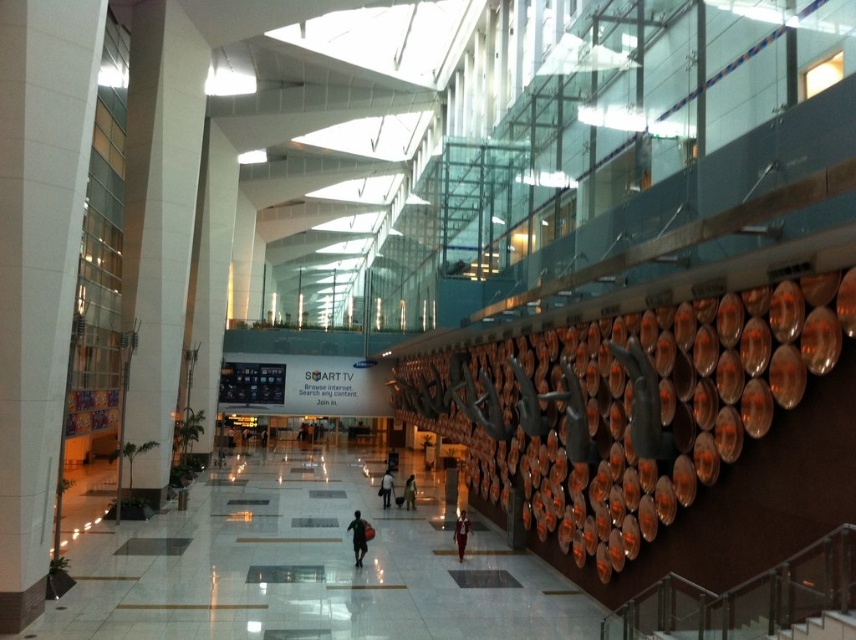
You are a store manager organizing a display in the mall. You have two dark brown leather jackets to place on the display rack. The dark brown leather jacket at lower center and the dark brown leather jacket at center. Which jacket should you choose to place in a spot where space is limited?

The dark brown leather jacket at lower center occupies less space than the dark brown leather jacket at center, so it is better suited for the limited space.

You are a store employee who needs to place a dark gray fabric bag at center and a dark brown leather jacket at center onto a display shelf that can only hold items up to 50 cm in width. Which item should you place first to ensure both fit?

The dark gray fabric bag at center is wider than the dark brown leather jacket at center. Since the shelf can only hold items up to 50 cm, you should place the narrower item, the dark brown leather jacket at center, first to ensure both fit within the width constraint.